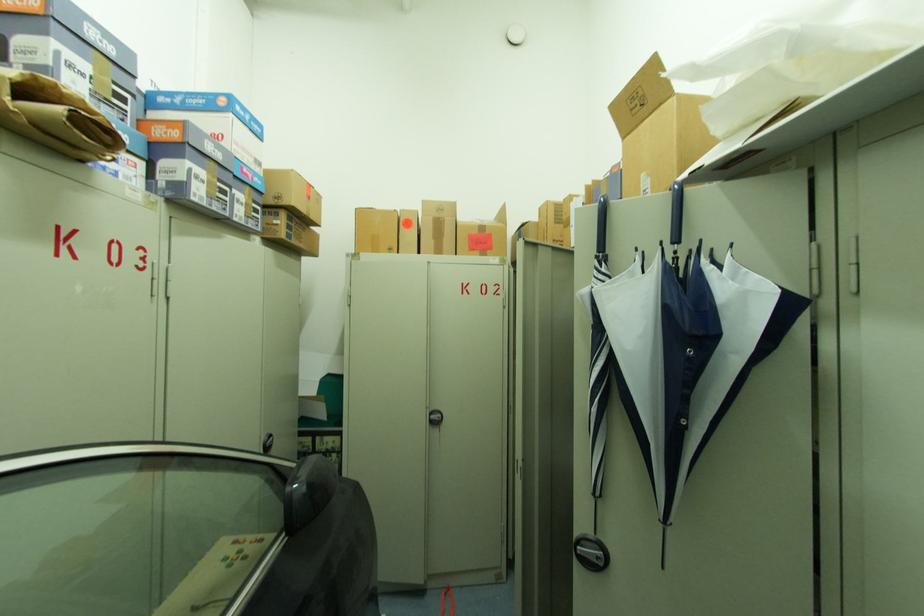
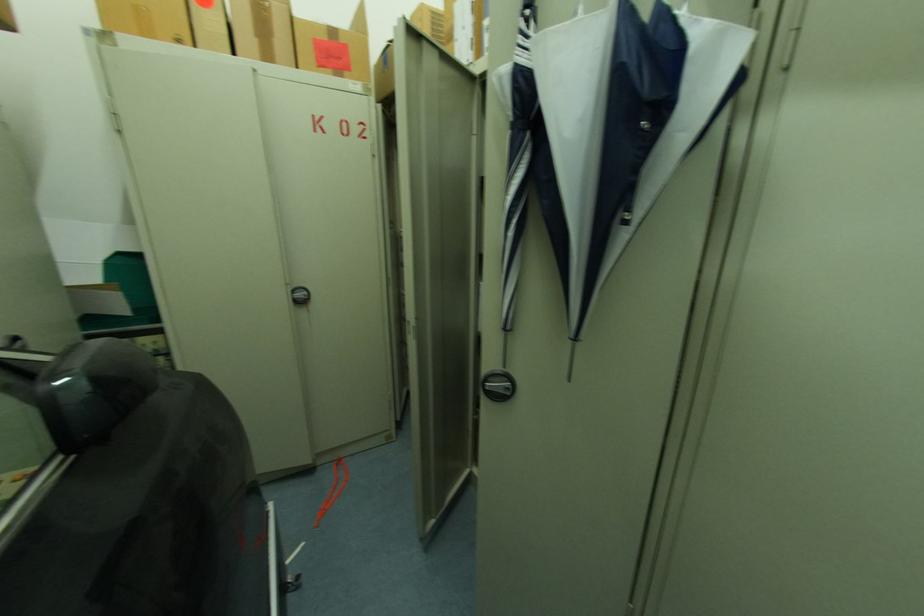
The first image is from the beginning of the video and the second image is from the end. How did the camera likely rotate when shooting the video?

The rotation direction of the camera is right-down.